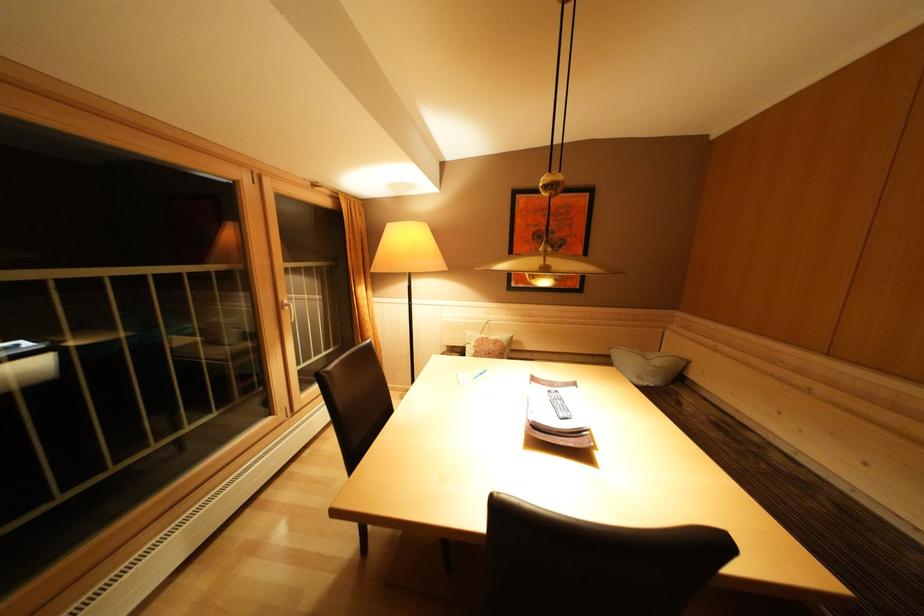
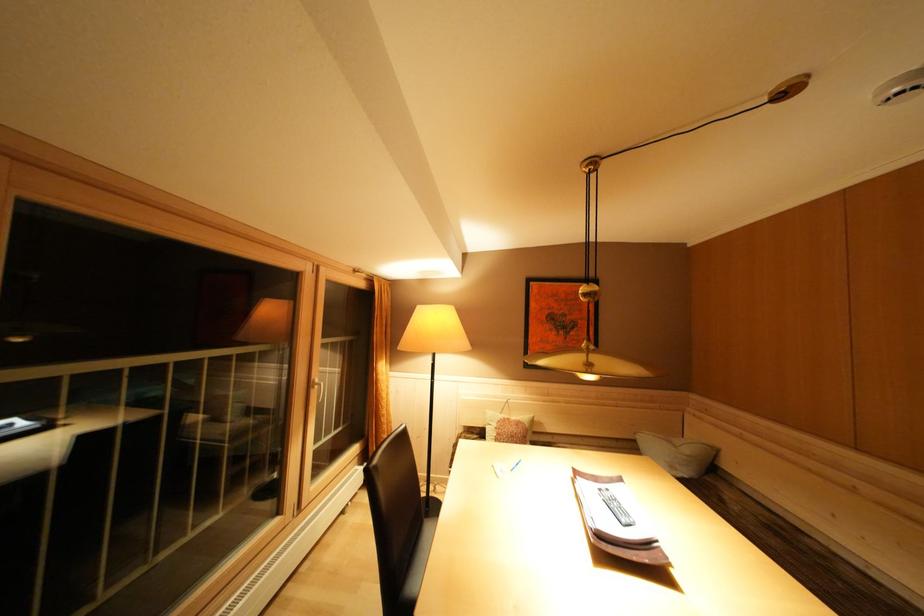
Locate, in the second image, the point that corresponds to [334,378] in the first image.

(383, 472)